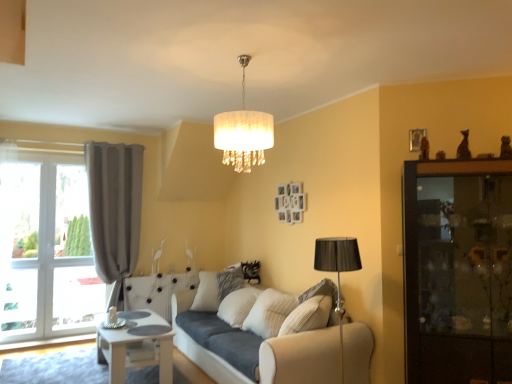
Question: Is dark wood cabinet at right in front of white fabric lampshade at center?

Choices:
 (A) no
 (B) yes

Answer: (A)

Question: From the image's perspective, is dark wood cabinet at right located beneath white fabric lampshade at center?

Choices:
 (A) yes
 (B) no

Answer: (A)

Question: Can you confirm if dark wood cabinet at right is smaller than white fabric lampshade at center?

Choices:
 (A) no
 (B) yes

Answer: (A)

Question: Is dark wood cabinet at right touching white fabric lampshade at center?

Choices:
 (A) yes
 (B) no

Answer: (B)

Question: Is white fabric lampshade at center surrounded by dark wood cabinet at right?

Choices:
 (A) no
 (B) yes

Answer: (A)

Question: From a real-world perspective, is white fabric lampshade at center positioned above or below matte gray curtain at left?

Choices:
 (A) below
 (B) above

Answer: (B)

Question: Relative to matte gray curtain at left, is white fabric lampshade at center in front or behind?

Choices:
 (A) behind
 (B) front

Answer: (B)

Question: Is white fabric lampshade at center situated inside matte gray curtain at left or outside?

Choices:
 (A) outside
 (B) inside

Answer: (A)

Question: From the image's perspective, is white fabric lampshade at center positioned above or below matte gray curtain at left?

Choices:
 (A) below
 (B) above

Answer: (B)

Question: In terms of height, does beige fabric couch at center look taller or shorter compared to dark wood cabinet at right?

Choices:
 (A) short
 (B) tall

Answer: (A)

Question: In terms of width, does beige fabric couch at center look wider or thinner when compared to dark wood cabinet at right?

Choices:
 (A) wide
 (B) thin

Answer: (A)

Question: Does point (279, 352) appear closer or farther from the camera than point (415, 354)?

Choices:
 (A) farther
 (B) closer

Answer: (A)

Question: From a real-world perspective, is beige fabric couch at center above or below dark wood cabinet at right?

Choices:
 (A) below
 (B) above

Answer: (A)

Question: Looking at their shapes, would you say beige fabric couch at center is wider or thinner than white fabric lampshade at center?

Choices:
 (A) wide
 (B) thin

Answer: (A)

Question: Is point (188, 316) closer or farther from the camera than point (239, 150)?

Choices:
 (A) farther
 (B) closer

Answer: (A)